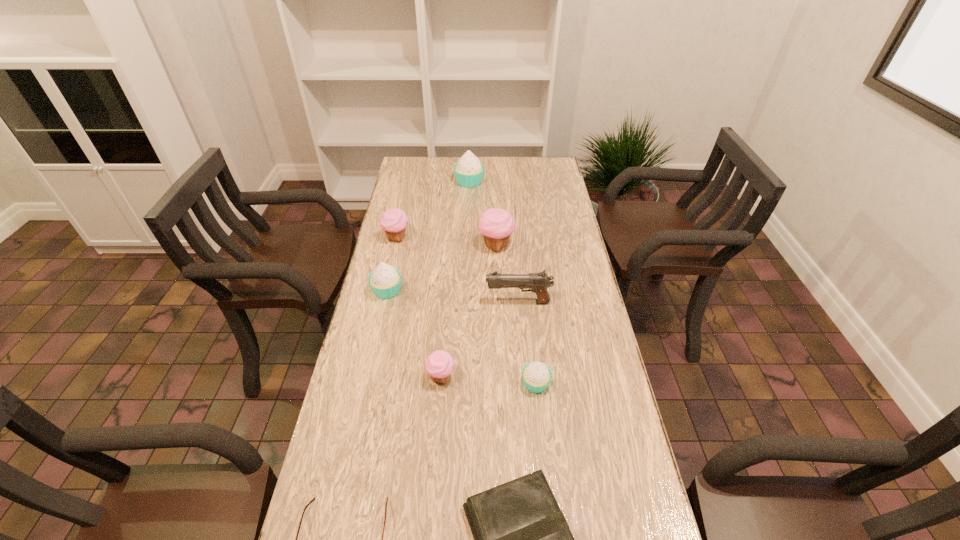
This screenshot has height=540, width=960. What are the coordinates of `the biggest pink cupcake` in the screenshot? It's located at pyautogui.click(x=496, y=225).

Where is `the biggest white cupcake`? This screenshot has width=960, height=540. the biggest white cupcake is located at coordinates (469, 171).

You are a GUI agent. You are given a task and a screenshot of the screen. Output one action in this format:
    pyautogui.click(x=<x>, y=<y>)
    Task: Click on the second white cupcake from right to left
    Image resolution: width=960 pixels, height=540 pixels.
    Given the screenshot: What is the action you would take?
    pyautogui.click(x=469, y=171)

At what (x,y) coordinates should I click in order to perform the action: click on gray gun. Please return your answer as a coordinate pair (x, y). Image resolution: width=960 pixels, height=540 pixels. Looking at the image, I should click on (538, 282).

At what (x,y) coordinates should I click in order to perform the action: click on the second nearest white cupcake. Please return your answer as a coordinate pair (x, y). This screenshot has width=960, height=540. Looking at the image, I should click on (385, 281).

Image resolution: width=960 pixels, height=540 pixels. Identify the location of the leftmost white cupcake. (385, 281).

You are a GUI agent. You are given a task and a screenshot of the screen. Output one action in this format:
    pyautogui.click(x=<x>, y=<y>)
    Task: Click on the leftmost pink cupcake
    
    Given the screenshot: What is the action you would take?
    pyautogui.click(x=394, y=221)

Identify the location of the nearest white cupcake. (536, 376).

In order to click on the rightmost white cupcake in this screenshot , I will do `click(536, 376)`.

Find the location of a particular element. This screenshot has width=960, height=540. the nearest pink cupcake is located at coordinates (440, 364).